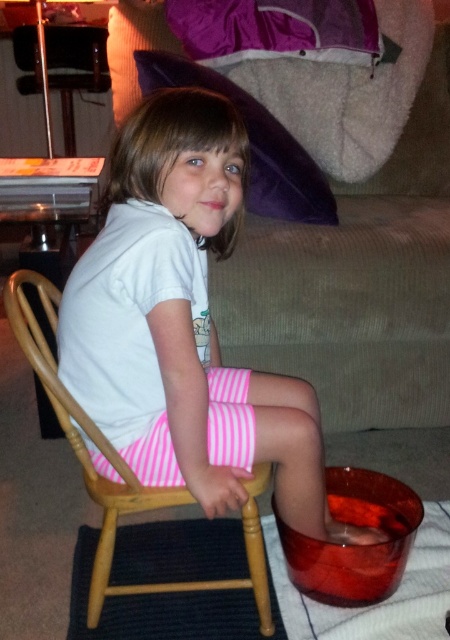
Does white cotton shirt at center have a lesser height compared to beige corduroy couch at center?

Yes, white cotton shirt at center is shorter than beige corduroy couch at center.

Is point (156, 484) farther from camera compared to point (430, 125)?

No, it is in front of (430, 125).

Where is `white cotton shirt at center`? white cotton shirt at center is located at coordinates [x=184, y=324].

Is beige corduroy couch at center thinner than pink striped shorts at center?

No.

Consider the image. Measure the distance from beige corduroy couch at center to pink striped shorts at center.

beige corduroy couch at center and pink striped shorts at center are 58.59 centimeters apart.

Between point (135, 6) and point (153, 458), which one is positioned in front?

Point (153, 458) is more forward.

What are the coordinates of `beige corduroy couch at center` in the screenshot? It's located at (356, 284).

Where is `white cotton shirt at center`? white cotton shirt at center is located at coordinates (184, 324).

Does white cotton shirt at center have a lesser height compared to wooden rocking chair at center?

No.

The width and height of the screenshot is (450, 640). Describe the element at coordinates (184, 324) in the screenshot. I see `white cotton shirt at center` at that location.

Locate an element on the screen. white cotton shirt at center is located at coordinates [184, 324].